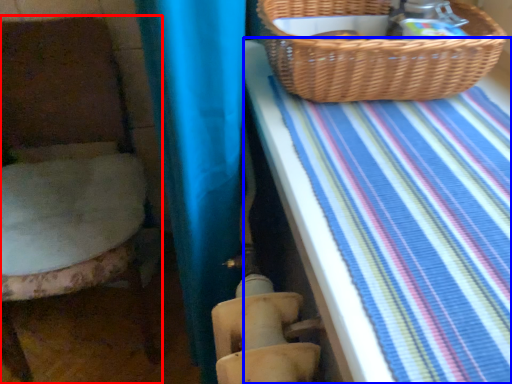
Question: Which object appears farthest to the camera in this image, furniture (highlighted by a red box) or sheet (highlighted by a blue box)?

Choices:
 (A) furniture
 (B) sheet

Answer: (A)